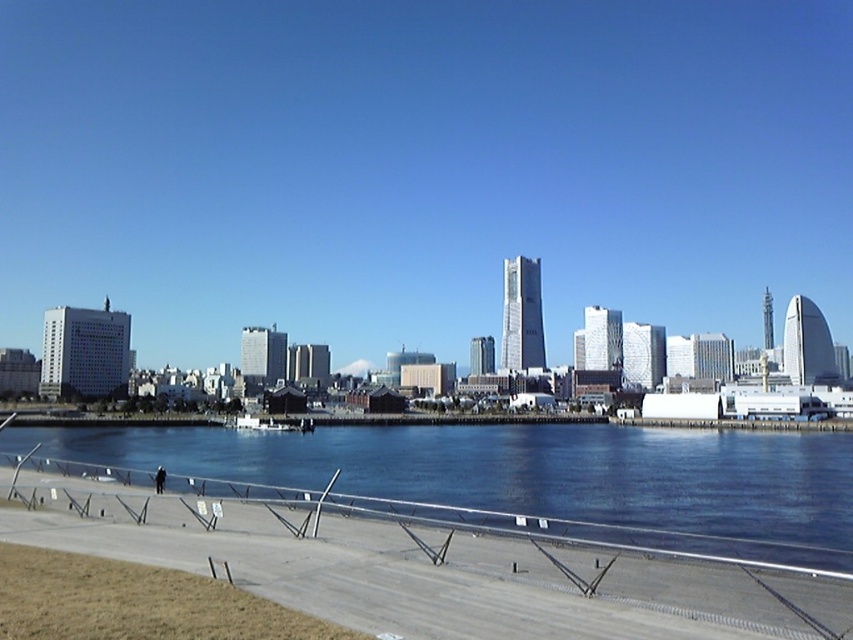
You are standing on the walkway and want to know which area takes up more space in the scene. Based on the blue glassy water at lower center and the brown grass at lower left, which one is larger?

The blue glassy water at lower center is bigger than the brown grass at lower left, so it takes up more space in the scene.

You are a city planner assessing the view from the walkway. Considering the transparent glass skyscrapers at center and the brown grass at lower left, which object would block a viewer standing on the walkway from seeing the water behind it?

The transparent glass skyscrapers at center might block the view since they are wider than the brown grass at lower left, potentially obstructing the line of sight to the water behind.

You are standing at the edge of the walkway and want to take a photo of both the point at coordinates point (575,492) and the point at coordinates point (289,612). Which point should you focus on first to ensure both are in focus?

You should focus on the point at coordinates point (575,492) first because it is closer to the camera than point (289,612). This ensures both points will be in focus as the depth of field will cover the distance between them.